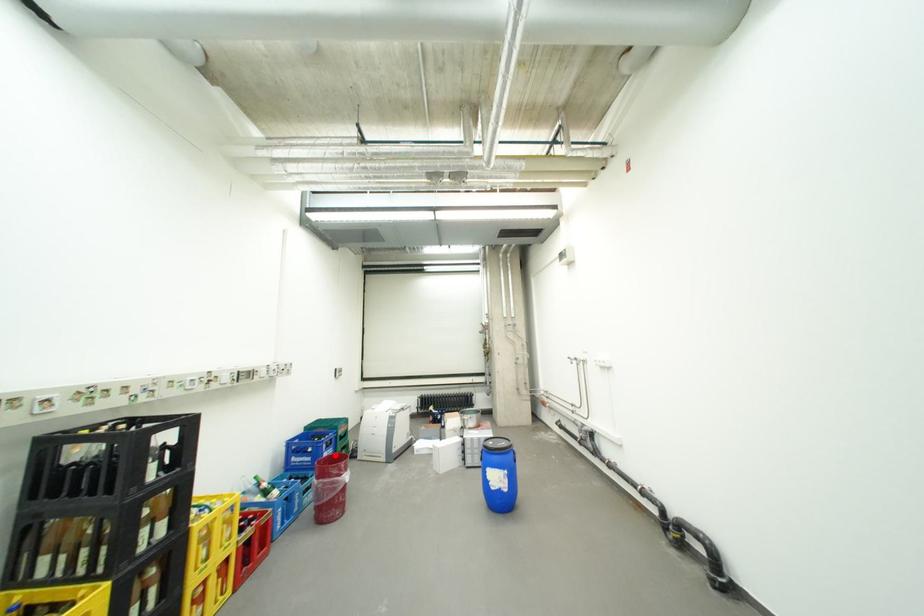
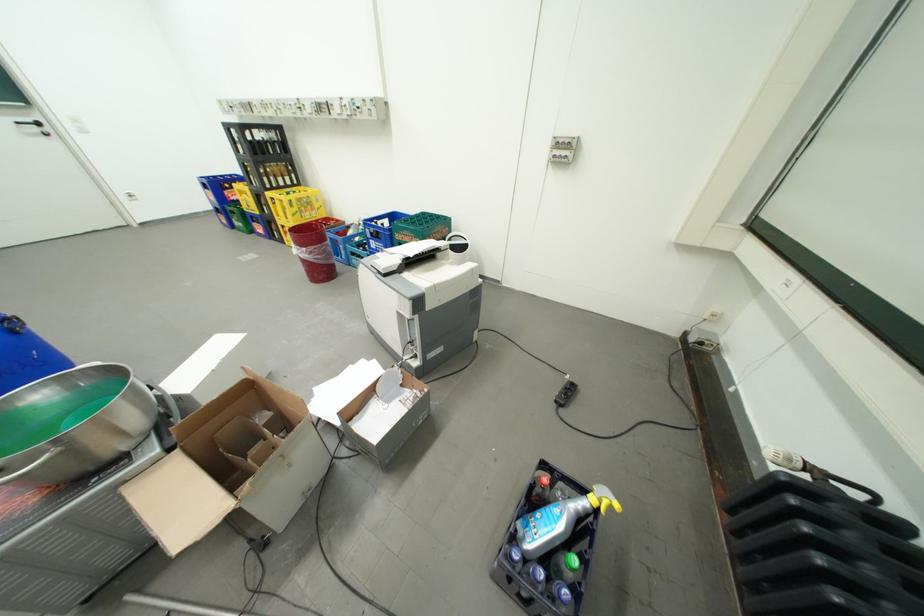
Question: I am providing you with two images of the same scene from different viewpoints. Image1 has a red point marked. In image2, the corresponding 3D location appears at what relative position? Reply with the corresponding letter.

Choices:
 (A) Closer
 (B) Farther

Answer: (B)